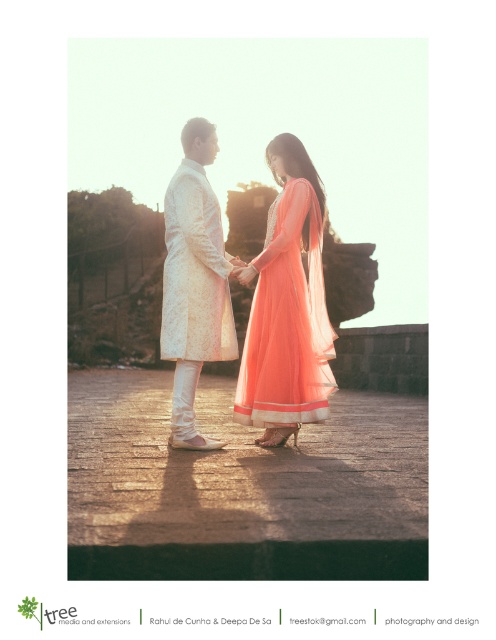
You are a photographer planning to capture a portrait of the two individuals wearing the matte peach gown at center and the white textured sherwani at center. Based on their sizes, which clothing item would you suggest placing closer to the camera to emphasize its prominence in the photo?

The matte peach gown at center is larger in size than the white textured sherwani at center, so placing the matte peach gown at center closer to the camera would emphasize its prominence in the photo.

You are a photographer trying to capture the two people in the scene. You want to ensure that the matte white sherwani at center and the matte peach gown at center are both clearly visible in your photo. Based on their positions, which one should you focus on first to ensure both are in focus?

The matte white sherwani at center is in front of the matte peach gown at center, so you should focus on the matte white sherwani at center first to ensure both are in focus.